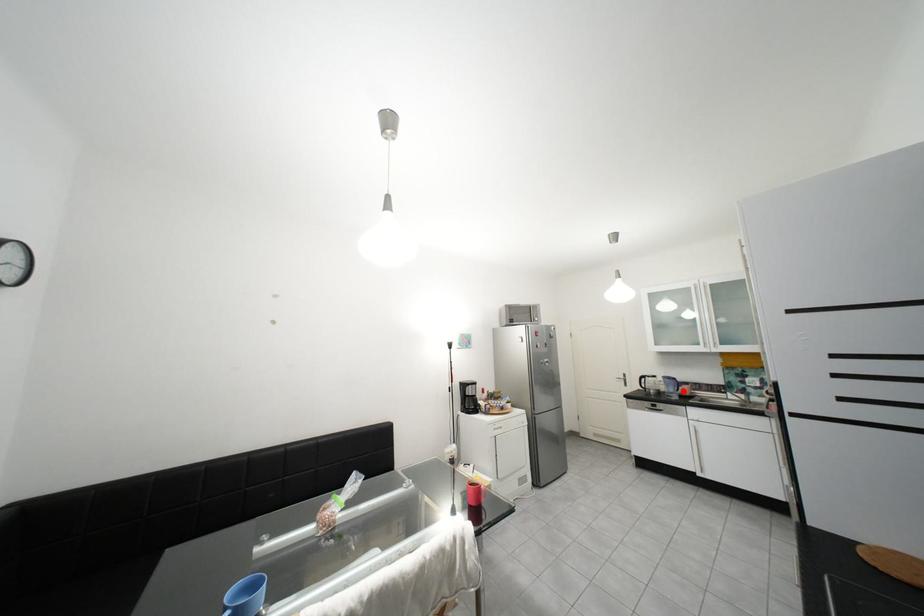
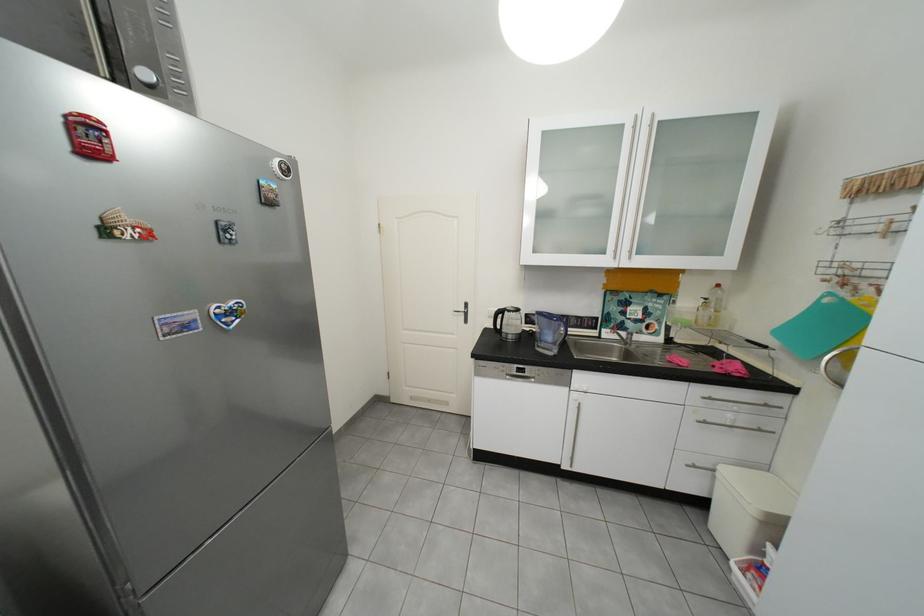
Where in the second image is the point corresponding to the highlighted location from the first image?

(561, 339)